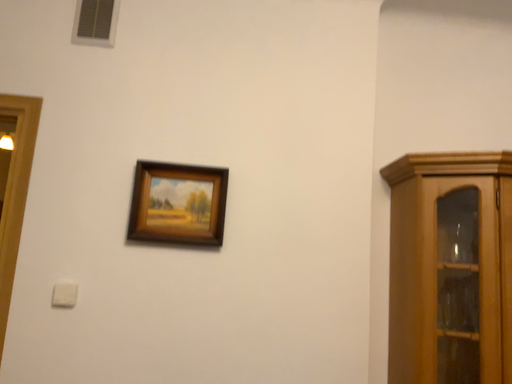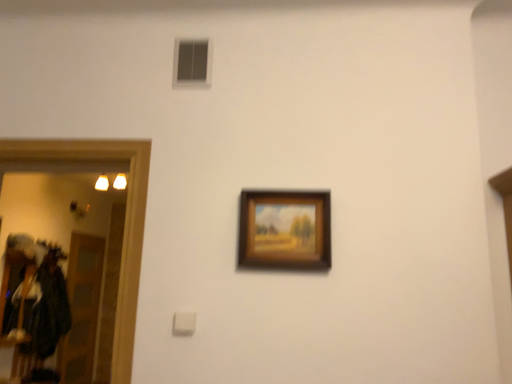
Question: How did the camera likely rotate when shooting the video?

Choices:
 (A) rotated left
 (B) rotated right

Answer: (A)